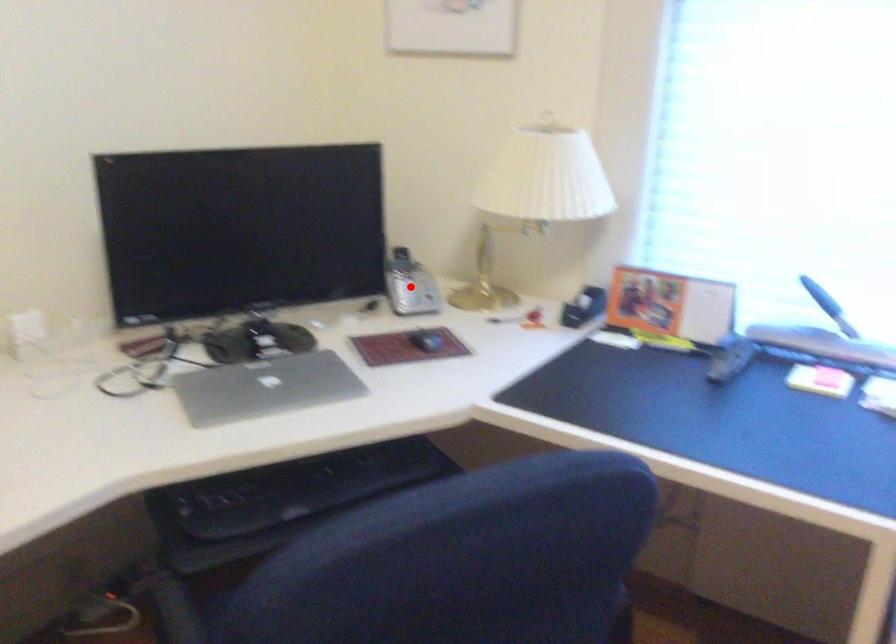
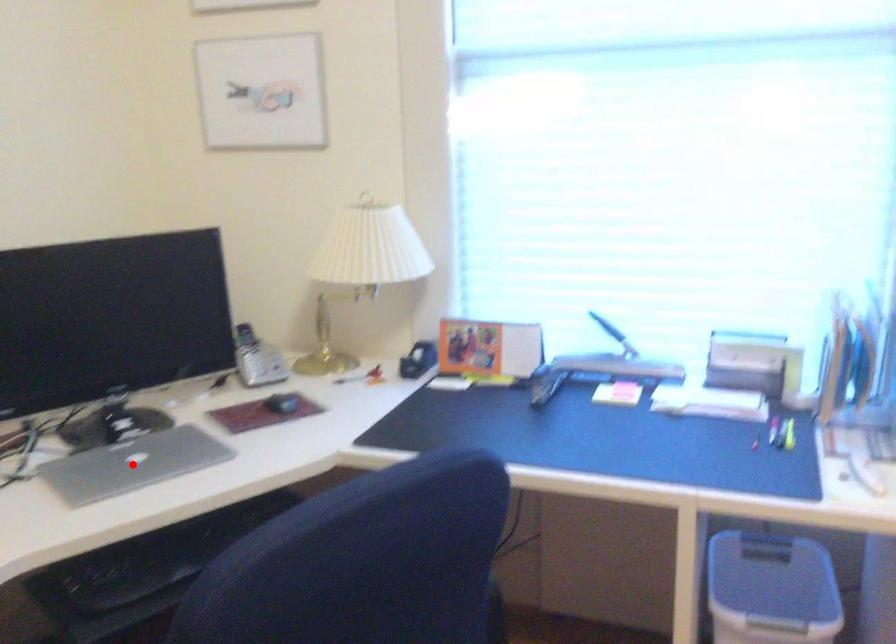
I am providing you with two images of the same scene from different viewpoints. A red point is marked on the first image and another point is marked on the second image. Is the red point in image1 aligned with the point shown in image2?

No